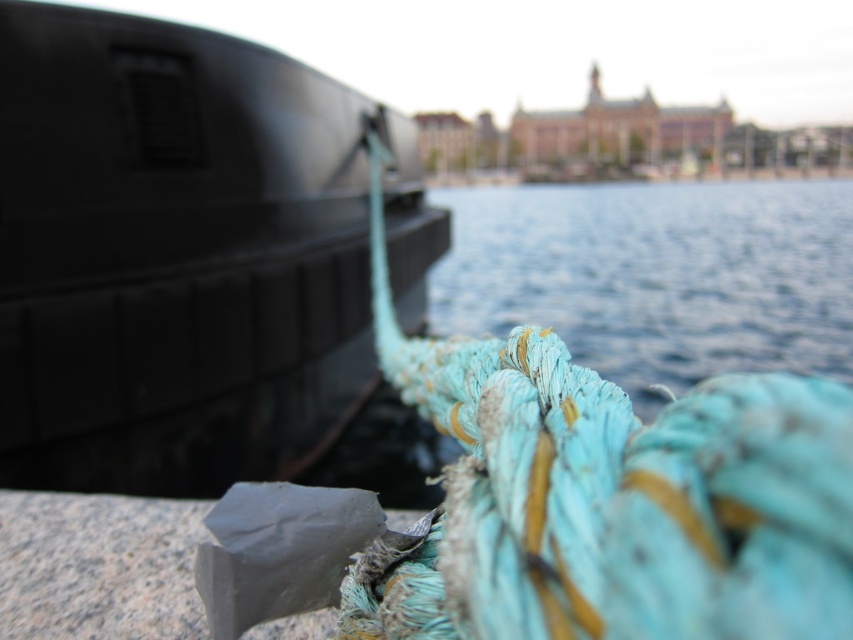
Is point (10, 8) positioned behind point (660, 323)?

No, it is not.

Does matte black boat at left have a greater width compared to blue fabric water at center?

No, matte black boat at left is not wider than blue fabric water at center.

The height and width of the screenshot is (640, 853). Describe the element at coordinates (184, 252) in the screenshot. I see `matte black boat at left` at that location.

Identify the location of matte black boat at left. (184, 252).